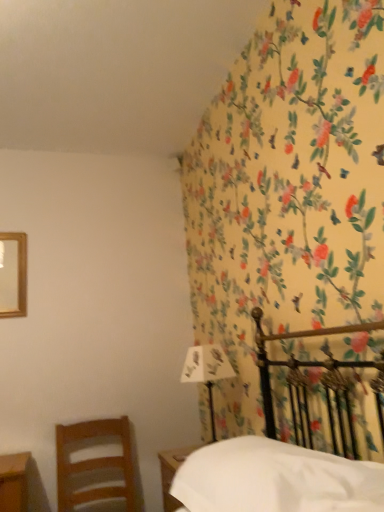
Question: From their relative heights in the image, would you say white matte sheet at lower right is taller or shorter than wooden chair at left?

Choices:
 (A) tall
 (B) short

Answer: (B)

Question: Looking at their shapes, would you say white matte sheet at lower right is wider or thinner than wooden chair at left?

Choices:
 (A) thin
 (B) wide

Answer: (A)

Question: Which object is the closest to the white matte sheet at lower right?

Choices:
 (A) wooden nightstand at lower center
 (B) wooden chair at left
 (C) white paper at upper right

Answer: (A)

Question: Estimate the real-world distances between objects in this image. Which object is farther from the wooden chair at left?

Choices:
 (A) wooden nightstand at lower center
 (B) white paper at upper right
 (C) white matte sheet at lower right

Answer: (C)